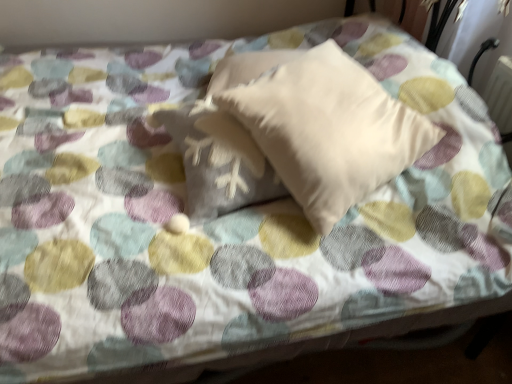
Question: Considering the relative sizes of beige soft pillow at center, which ranks as the 1th pillow in right-to-left order, and beige soft pillow at center, which is counted as the 1th pillow, starting from the left, in the image provided, is beige soft pillow at center, which ranks as the 1th pillow in right-to-left order, wider than beige soft pillow at center, which is counted as the 1th pillow, starting from the left,?

Choices:
 (A) yes
 (B) no

Answer: (A)

Question: Does beige soft pillow at center, which ranks as the 1th pillow in right-to-left order, have a lesser height compared to beige soft pillow at center, which is counted as the 1th pillow, starting from the left?

Choices:
 (A) yes
 (B) no

Answer: (B)

Question: Are beige soft pillow at center, which ranks as the 1th pillow in right-to-left order, and beige soft pillow at center, acting as the 2th pillow starting from the right, beside each other?

Choices:
 (A) no
 (B) yes

Answer: (A)

Question: Is beige soft pillow at center, which ranks as the 1th pillow in right-to-left order, located outside beige soft pillow at center, acting as the 2th pillow starting from the right?

Choices:
 (A) no
 (B) yes

Answer: (B)

Question: Is beige soft pillow at center, which ranks as the second pillow in left-to-right order, oriented away from beige soft pillow at center, acting as the 2th pillow starting from the right?

Choices:
 (A) yes
 (B) no

Answer: (A)

Question: Can you confirm if beige soft pillow at center, which ranks as the second pillow in left-to-right order, is bigger than beige soft pillow at center, acting as the 2th pillow starting from the right?

Choices:
 (A) no
 (B) yes

Answer: (B)

Question: Can you confirm if beige soft pillow at center, acting as the 2th pillow starting from the right, is positioned to the right of beige soft pillow at center, which ranks as the second pillow in left-to-right order?

Choices:
 (A) no
 (B) yes

Answer: (A)

Question: Is beige soft pillow at center, which is counted as the 1th pillow, starting from the left, not near beige soft pillow at center, which ranks as the 1th pillow in right-to-left order?

Choices:
 (A) yes
 (B) no

Answer: (B)

Question: Could you tell me if beige soft pillow at center, acting as the 2th pillow starting from the right, is turned towards beige soft pillow at center, which ranks as the second pillow in left-to-right order?

Choices:
 (A) no
 (B) yes

Answer: (B)

Question: Is beige soft pillow at center, which ranks as the second pillow in left-to-right order, a part of beige soft pillow at center, which is counted as the 1th pillow, starting from the left?

Choices:
 (A) no
 (B) yes

Answer: (A)

Question: Can you confirm if beige soft pillow at center, acting as the 2th pillow starting from the right, is bigger than beige soft pillow at center, which ranks as the 1th pillow in right-to-left order?

Choices:
 (A) no
 (B) yes

Answer: (A)

Question: From the image's perspective, would you say beige soft pillow at center, which is counted as the 1th pillow, starting from the left, is shown under beige soft pillow at center, which ranks as the second pillow in left-to-right order?

Choices:
 (A) no
 (B) yes

Answer: (B)

Question: Visually, is beige soft pillow at center, which ranks as the 1th pillow in right-to-left order, positioned to the left or to the right of beige soft pillow at center, which is counted as the 1th pillow, starting from the left?

Choices:
 (A) left
 (B) right

Answer: (B)